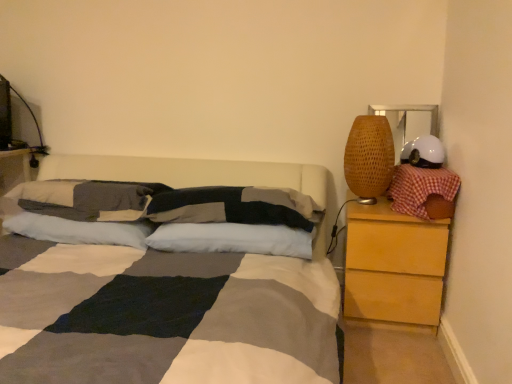
Question: Do you think white matte helmet at upper right is within woven bamboo lampshade at right, or outside of it?

Choices:
 (A) inside
 (B) outside

Answer: (B)

Question: Based on their sizes in the image, would you say white matte helmet at upper right is bigger or smaller than woven bamboo lampshade at right?

Choices:
 (A) small
 (B) big

Answer: (A)

Question: Which object is the closest to the white soft pillow at center, arranged as the 1th pillow when viewed from the left?

Choices:
 (A) red checkered pillow at right, which appears as the 5th pillow when viewed from the left
 (B) textured gray pillow at center, acting as the 3th pillow starting from the left
 (C) light brown wood chest of drawers at right
 (D) white soft pillow at center, acting as the second pillow starting from the right
 (E) woven bamboo lampshade at right

Answer: (D)

Question: Which of these objects is positioned farthest from the white soft pillow at center, acting as the second pillow starting from the right?

Choices:
 (A) white soft pillow at center, arranged as the 1th pillow when viewed from the left
 (B) textured cotton pillow at center, which is the fourth pillow from right to left
 (C) light brown wood chest of drawers at right
 (D) white matte helmet at upper right
 (E) textured gray pillow at center, acting as the 3th pillow starting from the left

Answer: (D)